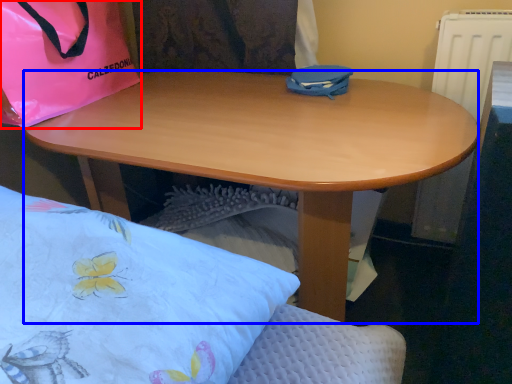
Question: Which object is closer to the camera taking this photo, handbag (highlighted by a red box) or desk (highlighted by a blue box)?

Choices:
 (A) handbag
 (B) desk

Answer: (B)